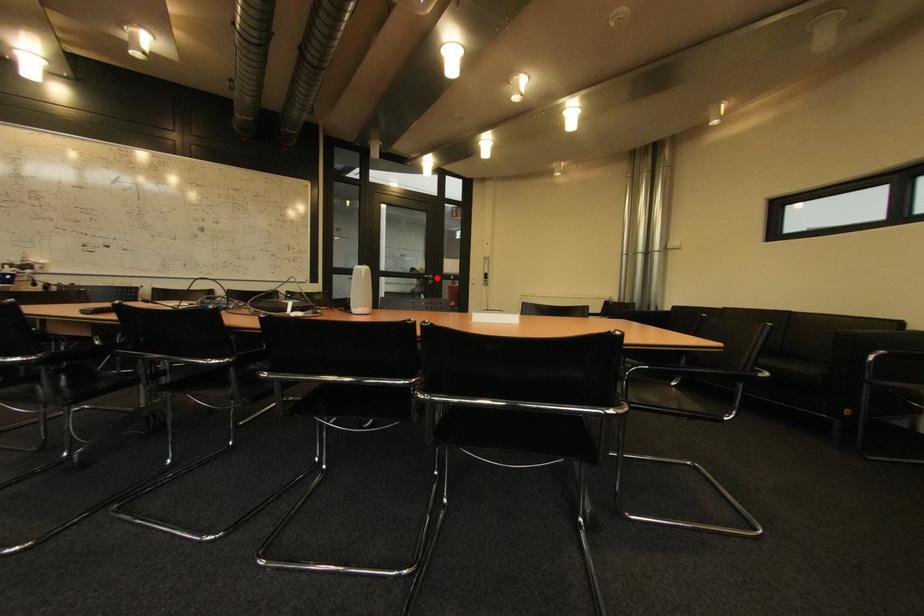
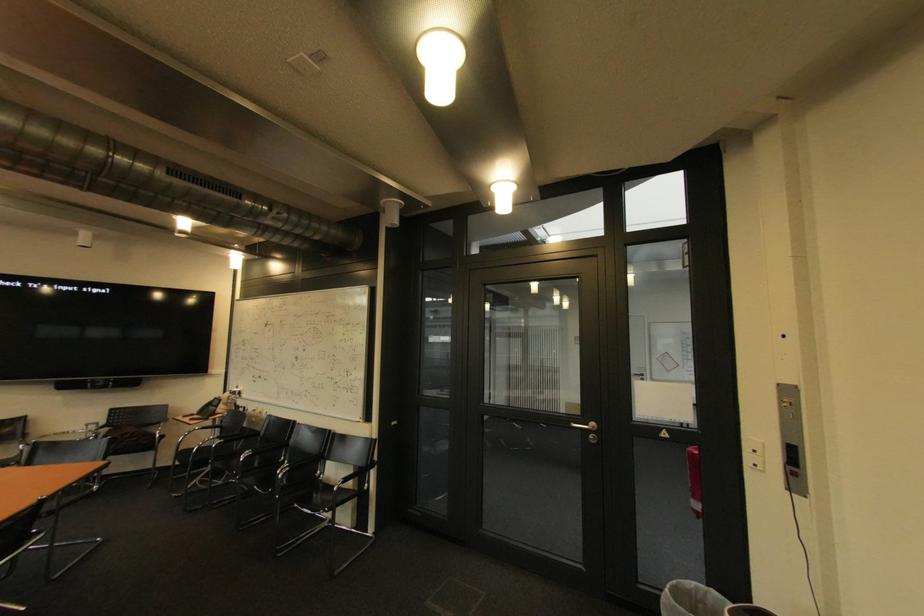
Question: I am providing you with two images of the same scene from different viewpoints. Given a red point in image1, look at the same physical point in image2. Is it:

Choices:
 (A) Closer to the viewpoint
 (B) Farther from the viewpoint

Answer: (B)